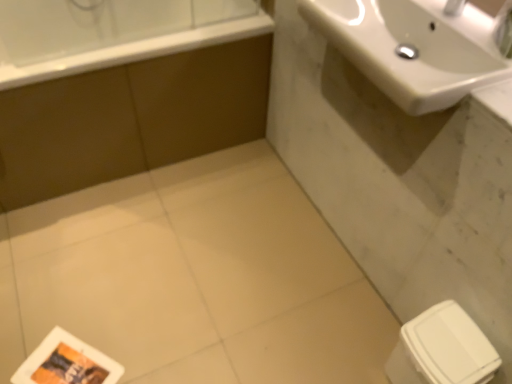
Question: Does white glossy bathtub at upper left come in front of brown matte bathtub at upper left?

Choices:
 (A) no
 (B) yes

Answer: (B)

Question: Does white glossy bathtub at upper left contain brown matte bathtub at upper left?

Choices:
 (A) yes
 (B) no

Answer: (B)

Question: From a real-world perspective, is white glossy bathtub at upper left located higher than brown matte bathtub at upper left?

Choices:
 (A) no
 (B) yes

Answer: (B)

Question: Does white glossy bathtub at upper left appear on the left side of brown matte bathtub at upper left?

Choices:
 (A) no
 (B) yes

Answer: (A)

Question: Is white glossy bathtub at upper left further to camera compared to brown matte bathtub at upper left?

Choices:
 (A) yes
 (B) no

Answer: (B)

Question: Considering the relative sizes of white glossy bathtub at upper left and brown matte bathtub at upper left in the image provided, is white glossy bathtub at upper left wider than brown matte bathtub at upper left?

Choices:
 (A) yes
 (B) no

Answer: (B)

Question: Considering the relative sizes of white glossy bathtub at upper left and white glossy sink at upper right in the image provided, is white glossy bathtub at upper left shorter than white glossy sink at upper right?

Choices:
 (A) no
 (B) yes

Answer: (A)

Question: Does white glossy bathtub at upper left contain white glossy sink at upper right?

Choices:
 (A) yes
 (B) no

Answer: (B)

Question: Is white glossy bathtub at upper left to the right of white glossy sink at upper right from the viewer's perspective?

Choices:
 (A) yes
 (B) no

Answer: (B)

Question: Is white glossy bathtub at upper left wider than white glossy sink at upper right?

Choices:
 (A) no
 (B) yes

Answer: (A)

Question: Is white glossy bathtub at upper left thinner than white glossy sink at upper right?

Choices:
 (A) no
 (B) yes

Answer: (B)

Question: Is white glossy bathtub at upper left positioned with its back to white glossy sink at upper right?

Choices:
 (A) no
 (B) yes

Answer: (A)

Question: Does white glossy sink at upper right lie behind brown matte bathtub at upper left?

Choices:
 (A) yes
 (B) no

Answer: (B)